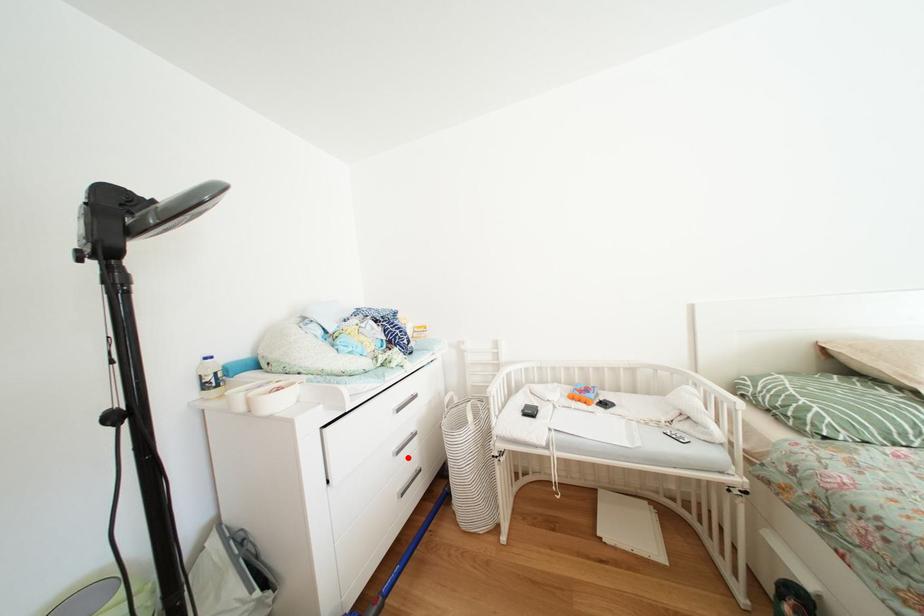
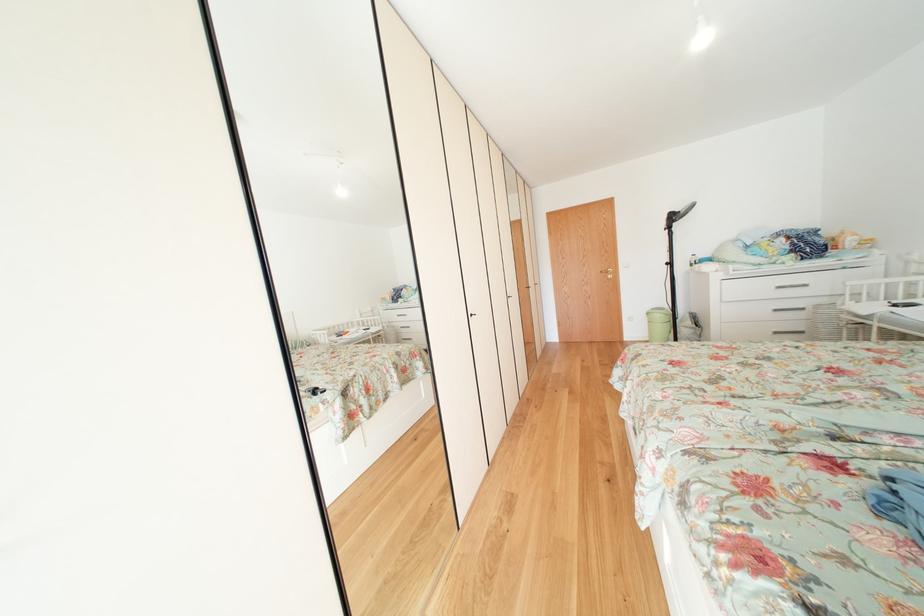
Where in the second image is the point corresponding to the highlighted location from the first image?

(784, 315)